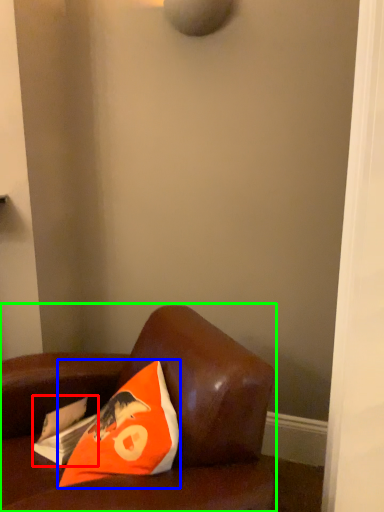
Question: Which is farther away from magazine (highlighted by a red box)? pillow (highlighted by a blue box) or furniture (highlighted by a green box)?

Choices:
 (A) pillow
 (B) furniture

Answer: (B)